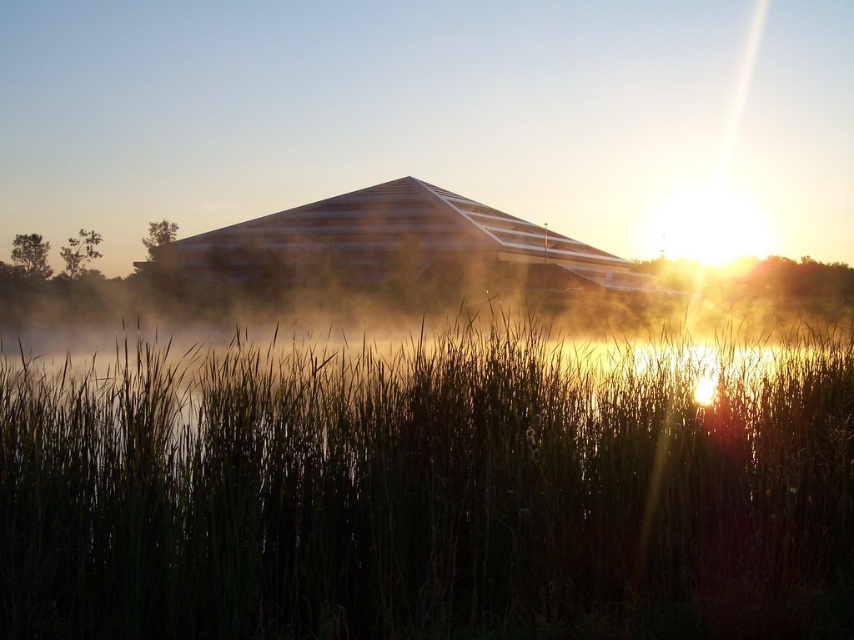
Who is more distant from viewer, (734, 358) or (349, 200)?

Positioned behind is point (349, 200).

I want to click on green grass at center, so click(x=425, y=486).